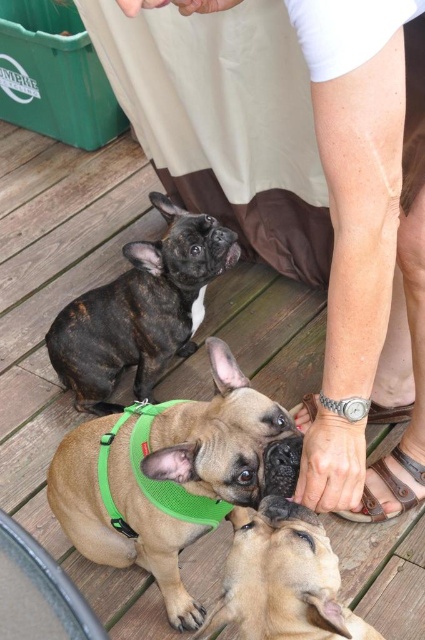
Identify the location of skinny white leg at upper center. This screenshot has height=640, width=425. (300, 179).

Is skinny white leg at upper center smaller than brown mesh harness at center?

No.

Measure the distance between point (251, 67) and camera.

Point (251, 67) is 5.21 feet away from camera.

The width and height of the screenshot is (425, 640). In order to click on skinny white leg at upper center in this screenshot , I will do `click(300, 179)`.

Who is positioned more to the right, green mesh harness at center or silver metallic sandal at lower center?

Positioned to the right is silver metallic sandal at lower center.

Between green mesh harness at center and silver metallic sandal at lower center, which one has less height?

silver metallic sandal at lower center is shorter.

What do you see at coordinates (172, 476) in the screenshot?
I see `green mesh harness at center` at bounding box center [172, 476].

You are a GUI agent. You are given a task and a screenshot of the screen. Output one action in this format:
    pyautogui.click(x=<x>, y=<y>)
    Task: Click on the green mesh harness at center
    
    Given the screenshot: What is the action you would take?
    pyautogui.click(x=172, y=476)

Between black fur dog at upper left and brown leather sandal at lower center, which one has less height?

With less height is brown leather sandal at lower center.

This screenshot has height=640, width=425. In order to click on black fur dog at upper left in this screenshot , I will do `click(141, 308)`.

Find the location of a particular element. Image resolution: width=425 pixels, height=640 pixels. black fur dog at upper left is located at coordinates (141, 308).